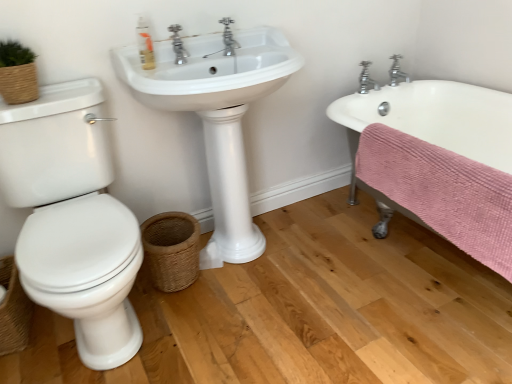
Locate an element on the screen. The height and width of the screenshot is (384, 512). free spot to the right of woven brown basket at lower center, acting as the 1th basket starting from the right is located at coordinates (236, 283).